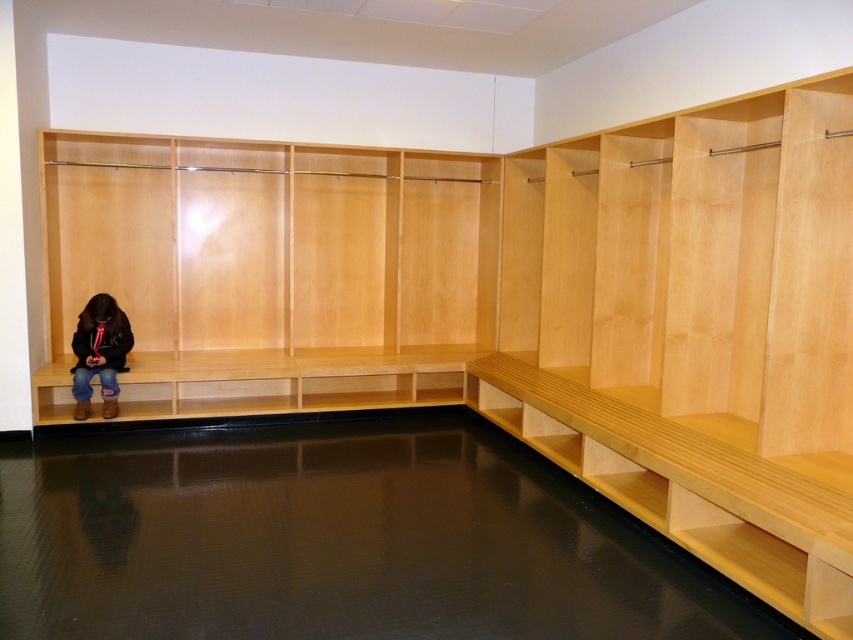
Can you confirm if light wood bench at left is wider than dark brown leather boots at lower left?

Yes, light wood bench at left is wider than dark brown leather boots at lower left.

Based on the photo, can you confirm if light wood bench at left is positioned to the right of dark brown leather boots at lower left?

Yes, light wood bench at left is to the right of dark brown leather boots at lower left.

This screenshot has height=640, width=853. In order to click on light wood bench at left in this screenshot , I will do `click(271, 269)`.